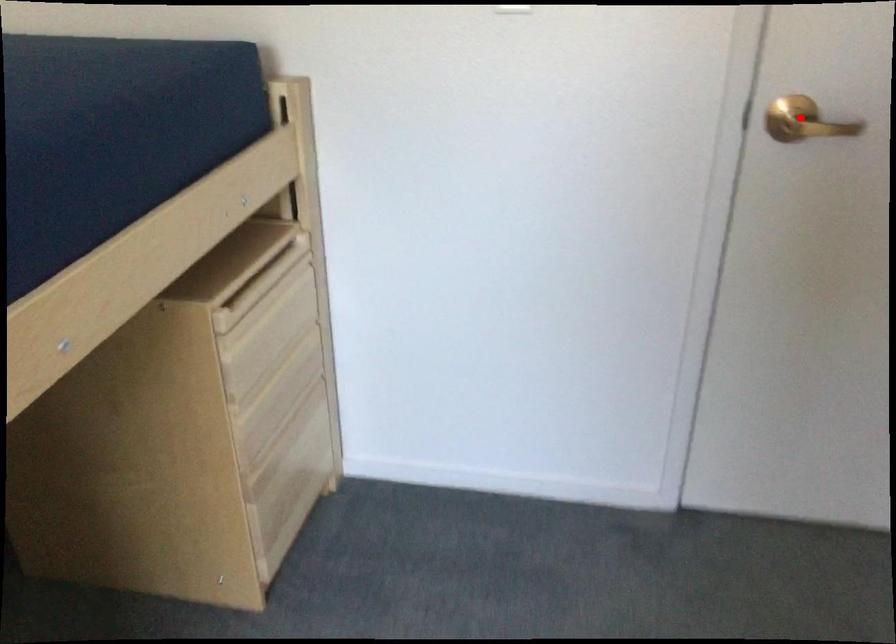
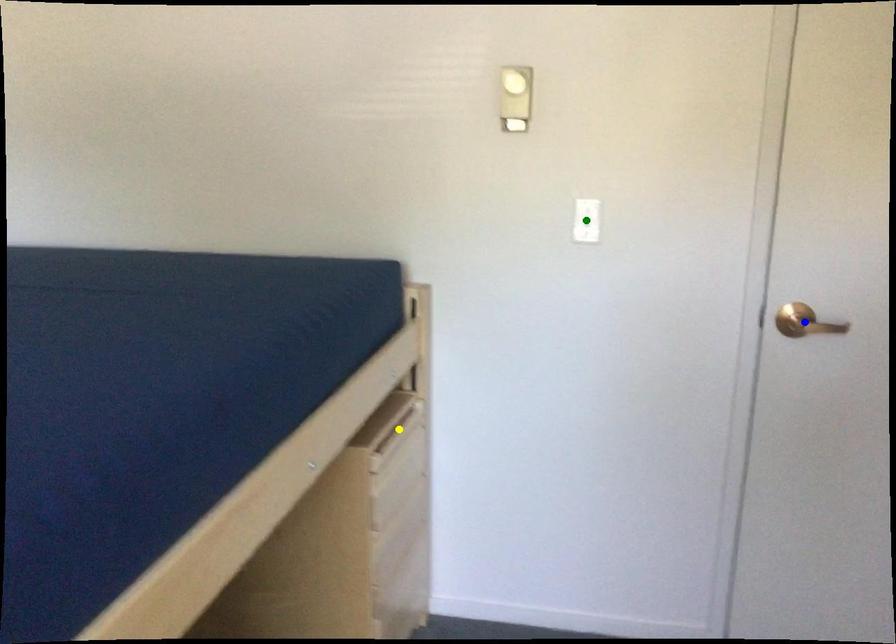
Question: I am providing you with two images of the same scene from different viewpoints. A red point is marked on the first image. You are given multiple points on the second image. In image 2, which mark is for the same physical point as the one in image 1?

Choices:
 (A) blue point
 (B) yellow point
 (C) green point

Answer: (A)